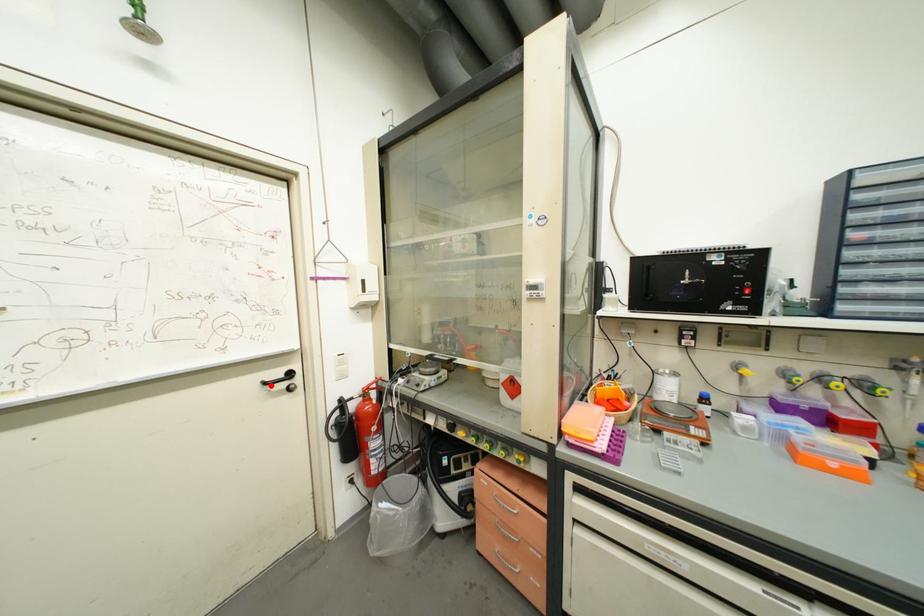
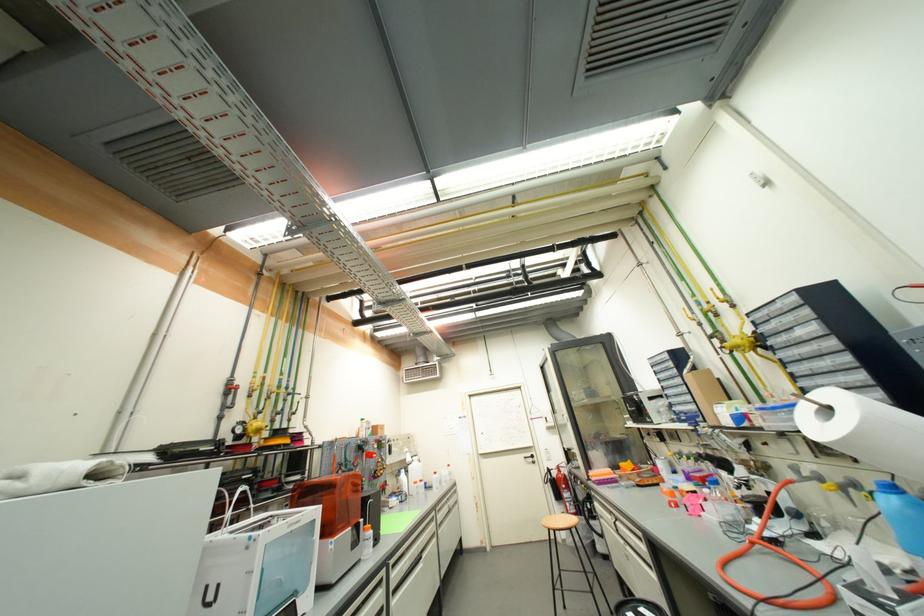
Question: I am providing you with two images of the same scene from different viewpoints. Given a red point in image1, look at the same physical point in image2. Is it:

Choices:
 (A) Closer to the viewpoint
 (B) Farther from the viewpoint

Answer: (B)